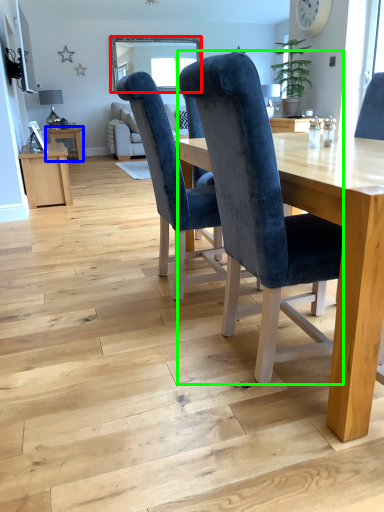
Question: Which object is positioned closest to window screen (highlighted by a red box)? Select from table (highlighted by a blue box) and chair (highlighted by a green box).

Choices:
 (A) table
 (B) chair

Answer: (A)